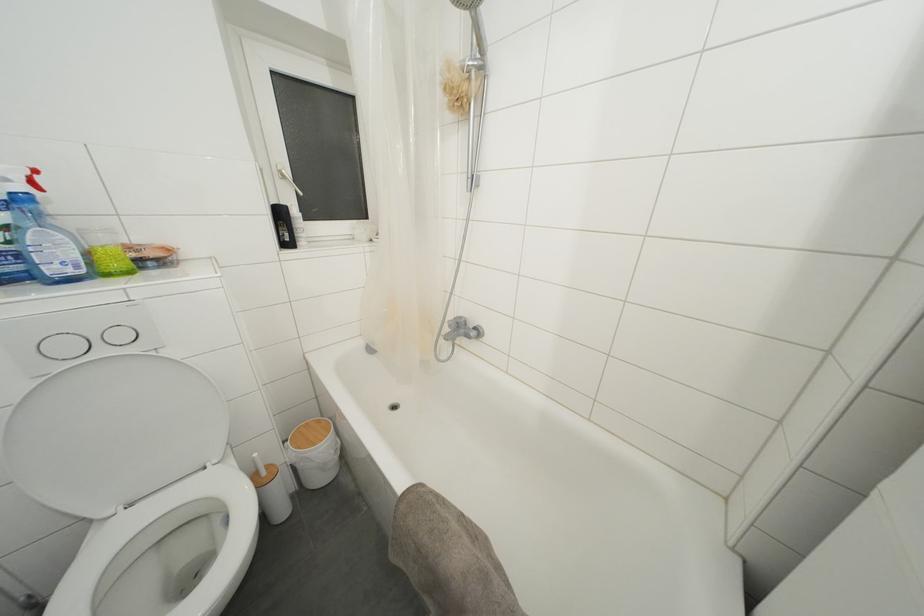
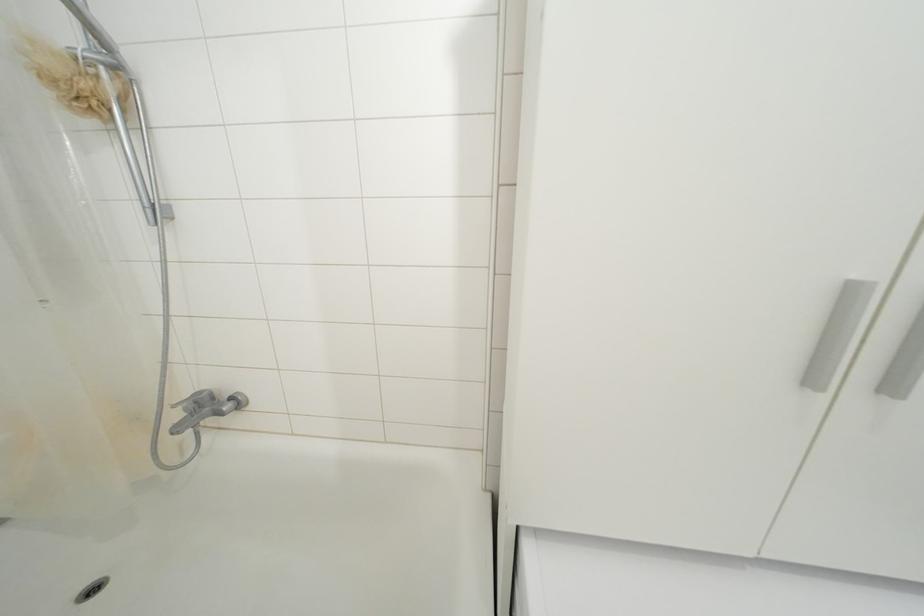
Question: The camera is either moving clockwise (left) or counter-clockwise (right) around the object. The first image is from the beginning of the video and the second image is from the end. Is the camera moving left or right when shooting the video?

Choices:
 (A) Left
 (B) Right

Answer: (A)